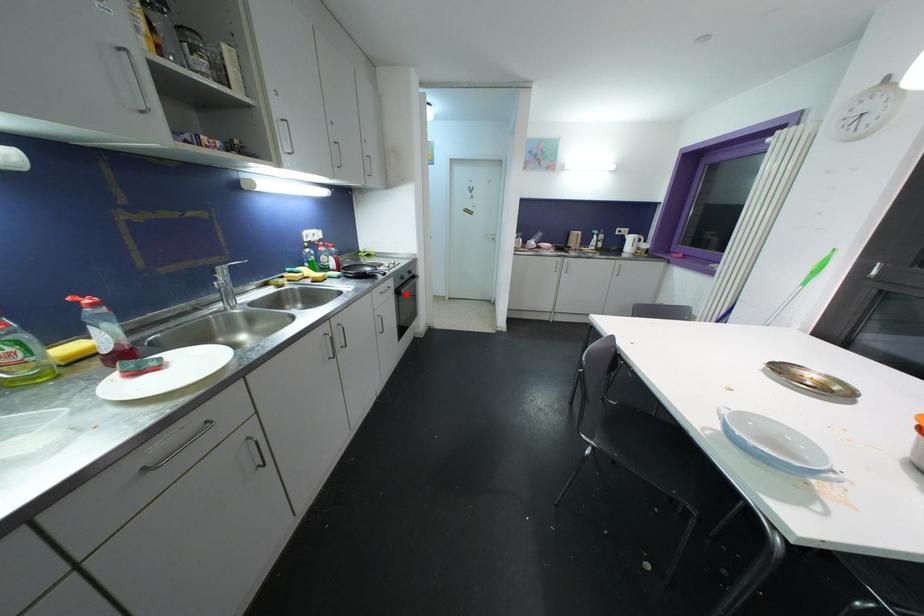
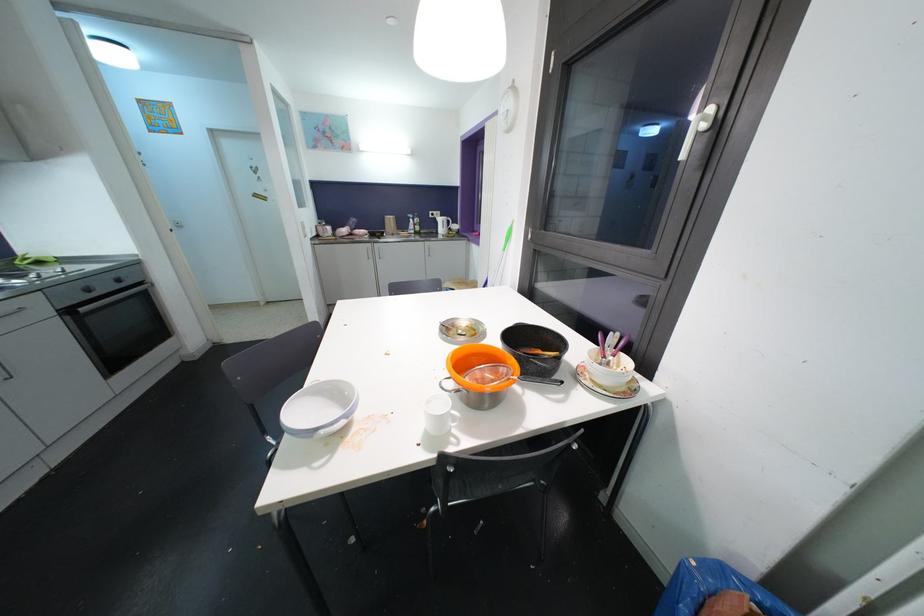
Find the pixel in the second image that matches the highlighted location in the first image.

(84, 312)